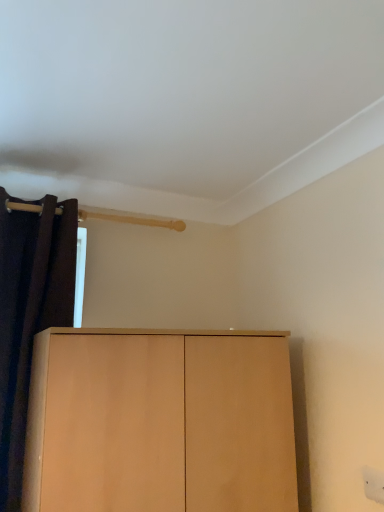
What do you see at coordinates (160, 422) in the screenshot? I see `light brown wood cupboard at lower left` at bounding box center [160, 422].

At what (x,y) coordinates should I click in order to perform the action: click on light brown wood cupboard at lower left. Please return your answer as a coordinate pair (x, y). Looking at the image, I should click on (160, 422).

Measure the distance between light brown wood cupboard at lower left and camera.

light brown wood cupboard at lower left is 3.42 feet from camera.

Find the location of a particular element. The height and width of the screenshot is (512, 384). light brown wood cupboard at lower left is located at coordinates (160, 422).